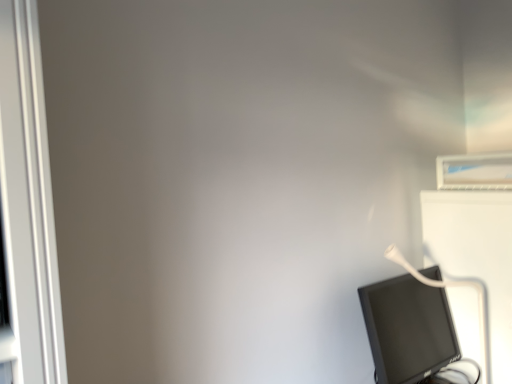
At what (x,y) coordinates should I click in order to perform the action: click on black glossy monitor at lower right. Please return your answer as a coordinate pair (x, y). The width and height of the screenshot is (512, 384). Looking at the image, I should click on (408, 329).

What is the approximate width of black glossy monitor at lower right?

The width of black glossy monitor at lower right is 7.65 inches.

The image size is (512, 384). What do you see at coordinates (408, 329) in the screenshot? I see `black glossy monitor at lower right` at bounding box center [408, 329].

In order to face black glossy monitor at lower right, should I rotate leftwards or rightwards?

Turn right by 21.483 degrees to look at black glossy monitor at lower right.

Identify the location of black glossy monitor at lower right. (408, 329).